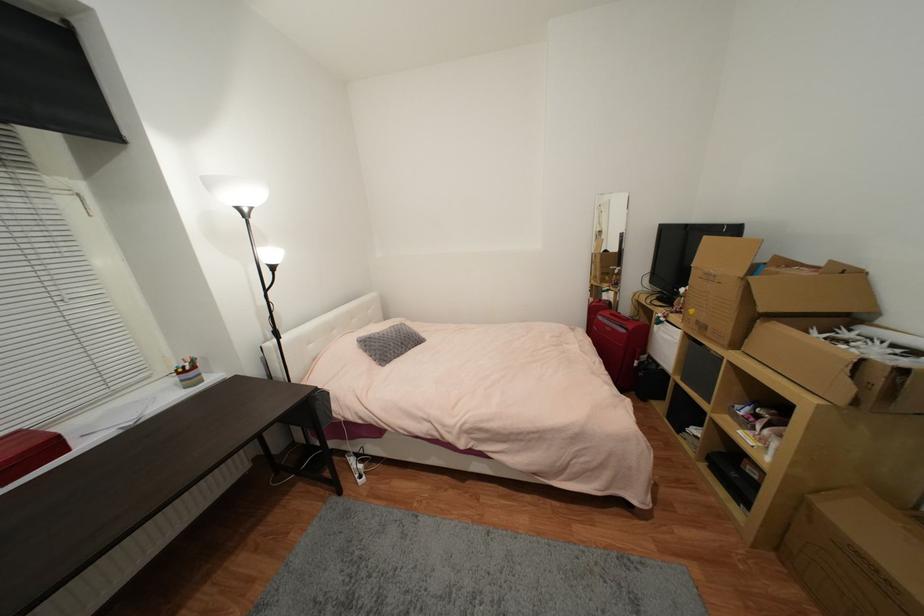
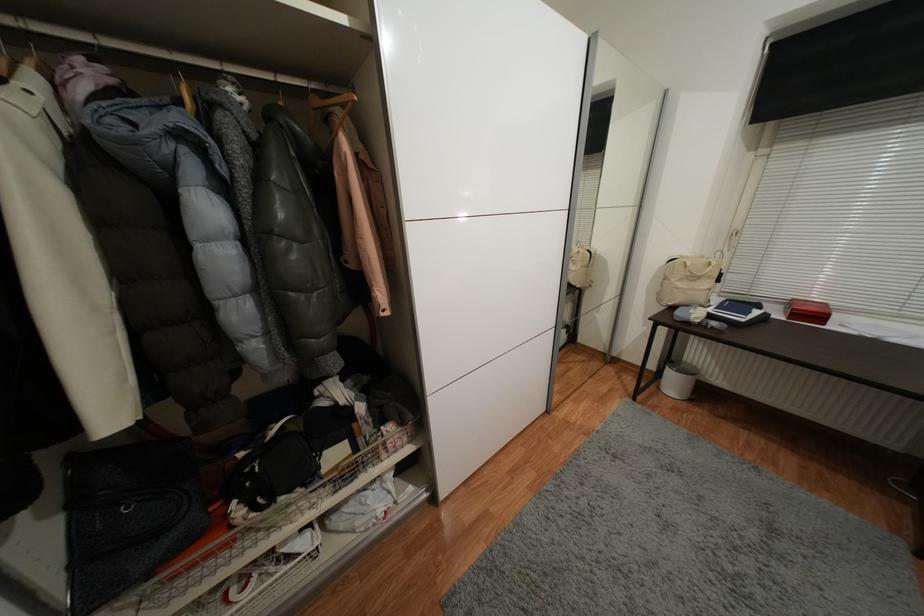
Where in the second image is the point corresponding to point (55, 448) from the first image?

(824, 318)